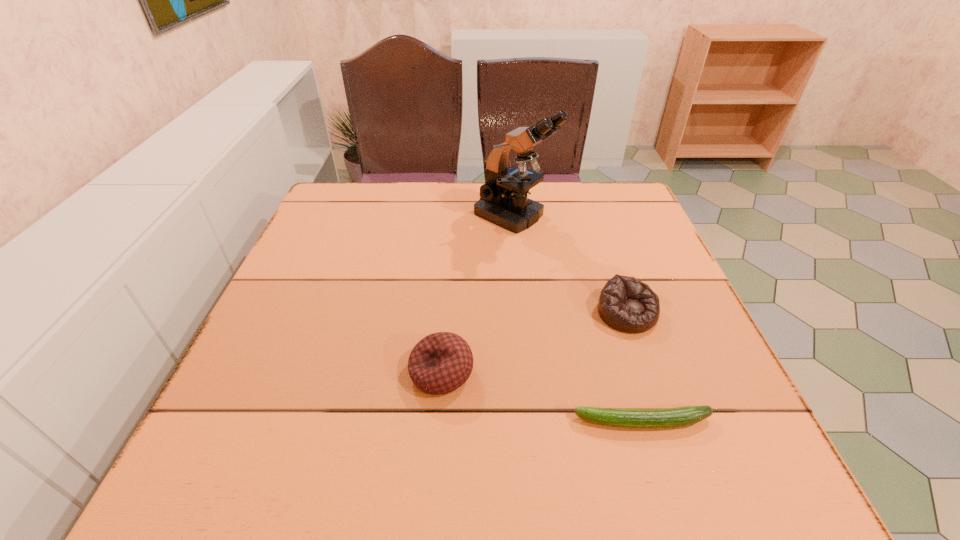
Locate an element on the screen. The image size is (960, 540). free space located on the left of the right beanbag is located at coordinates (467, 313).

Find the location of `free space located on the front-facing side of the zucchini`. free space located on the front-facing side of the zucchini is located at coordinates pos(372,422).

Where is `free space located 0.320m on the front-facing side of the zucchini`? This screenshot has height=540, width=960. free space located 0.320m on the front-facing side of the zucchini is located at coordinates (379, 422).

This screenshot has width=960, height=540. I want to click on free region located 0.050m on the front-facing side of the zucchini, so click(543, 422).

Locate an element on the screen. Image resolution: width=960 pixels, height=540 pixels. object at the far edge is located at coordinates (x=503, y=201).

You are a GUI agent. You are given a task and a screenshot of the screen. Output one action in this format:
    pyautogui.click(x=<x>, y=<y>)
    Task: Click on the beanbag that is at the right edge
    The height and width of the screenshot is (540, 960).
    Given the screenshot: What is the action you would take?
    click(626, 304)

Locate an element on the screen. Image resolution: width=960 pixels, height=540 pixels. zucchini that is at the right edge is located at coordinates (681, 416).

In the image, there is a desktop. Find the location of `vacant region at the far edge`. vacant region at the far edge is located at coordinates (587, 225).

Locate an element on the screen. The width and height of the screenshot is (960, 540). vacant region at the near edge of the desktop is located at coordinates (482, 439).

What are the coordinates of `vacant space at the left edge of the desktop` in the screenshot? It's located at (243, 400).